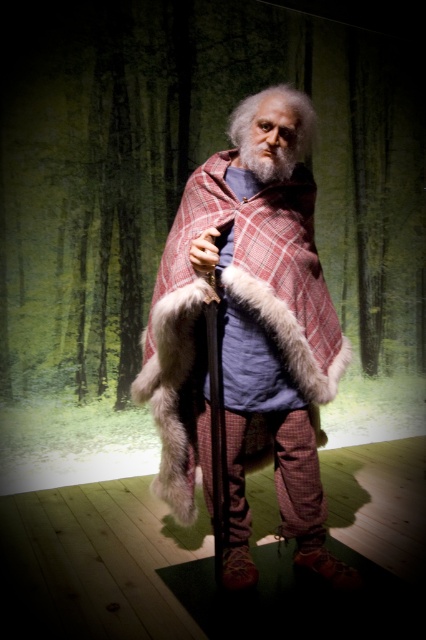
Question: Can you confirm if plaid wool cape at center is thinner than graywoollybeard at center?

Choices:
 (A) no
 (B) yes

Answer: (A)

Question: Which point is farther to the camera?

Choices:
 (A) (255, 172)
 (B) (253, 356)

Answer: (B)

Question: Among these points, which one is farthest from the camera?

Choices:
 (A) (270, 177)
 (B) (181, 522)

Answer: (B)

Question: Among these objects, which one is farthest from the camera?

Choices:
 (A) graywoollybeard at center
 (B) plaid wool cape at center

Answer: (A)

Question: Can you confirm if plaid wool cape at center is wider than graywoollybeard at center?

Choices:
 (A) yes
 (B) no

Answer: (A)

Question: Is plaid wool cape at center thinner than graywoollybeard at center?

Choices:
 (A) no
 (B) yes

Answer: (A)